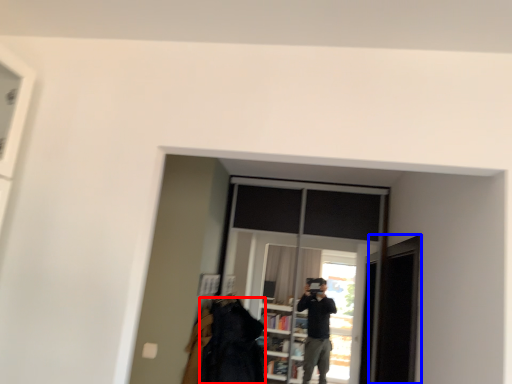
Question: Which object appears closest to the camera in this image, clothing (highlighted by a red box) or screen door (highlighted by a blue box)?

Choices:
 (A) clothing
 (B) screen door

Answer: (B)